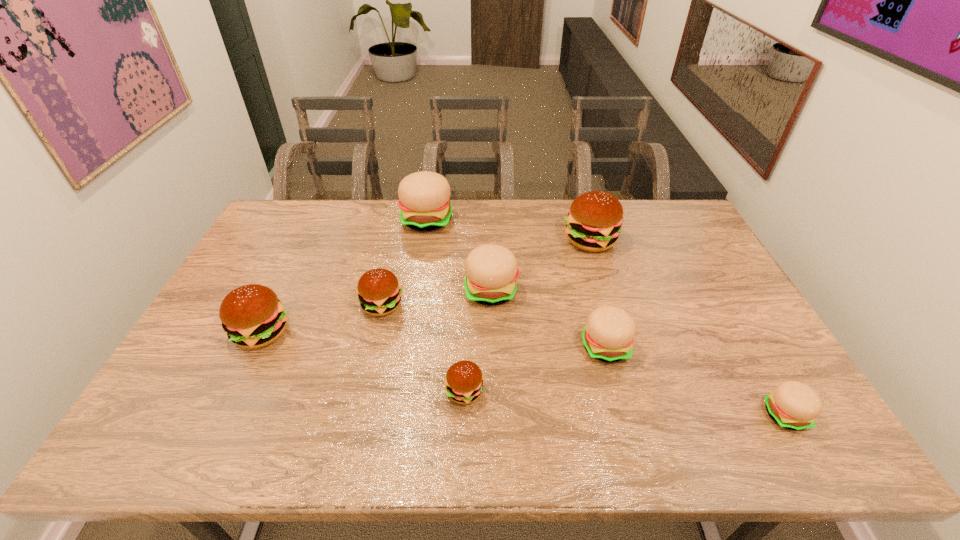
Find the location of a particular element. blank space that satisfies the following two spatial constraints: 1. on the back side of the third nearest beige hamburger; 2. on the left side of the second smallest brown hamburger is located at coordinates (385, 291).

This screenshot has width=960, height=540. Find the location of `vacant space that satisfies the following two spatial constraints: 1. on the front side of the biggest beige hamburger; 2. on the right side of the second brown hamburger from right to left`. vacant space that satisfies the following two spatial constraints: 1. on the front side of the biggest beige hamburger; 2. on the right side of the second brown hamburger from right to left is located at coordinates (400, 392).

This screenshot has height=540, width=960. What are the coordinates of `free space that satisfies the following two spatial constraints: 1. on the back side of the third brown hamburger from right to left; 2. on the right side of the farthest brown hamburger` in the screenshot? It's located at (396, 240).